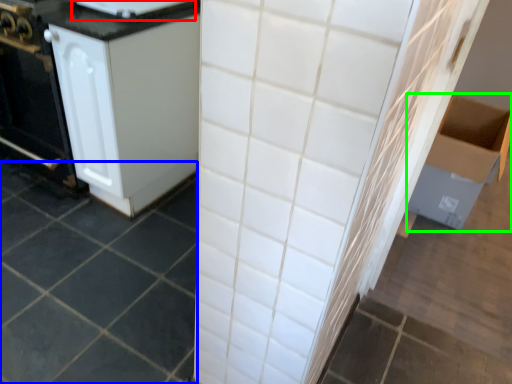
Question: Based on their relative distances, which object is farther from appliance (highlighted by a red box)? Choose from ceramic tile (highlighted by a blue box) and cardboard box (highlighted by a green box).

Choices:
 (A) ceramic tile
 (B) cardboard box

Answer: (B)